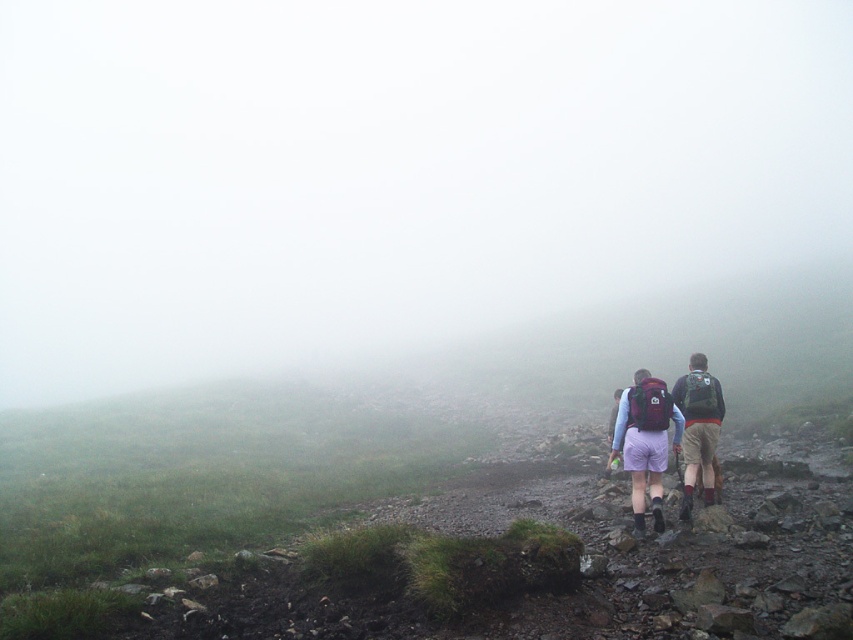
Question: Considering the relative positions of matte purple shorts at center and dark green backpack at right in the image provided, where is matte purple shorts at center located with respect to dark green backpack at right?

Choices:
 (A) right
 (B) left

Answer: (B)

Question: Does matte purple shorts at center lie in front of dark green backpack at right?

Choices:
 (A) yes
 (B) no

Answer: (A)

Question: Which of the following is the farthest from the observer?

Choices:
 (A) (683, 480)
 (B) (698, 429)

Answer: (A)

Question: Among these points, which one is farthest from the camera?

Choices:
 (A) (616, 420)
 (B) (700, 365)

Answer: (B)

Question: Which of the following is the farthest from the observer?

Choices:
 (A) (722, 408)
 (B) (705, 445)

Answer: (B)

Question: Is matte purple shorts at center smaller than dark green backpack at right?

Choices:
 (A) yes
 (B) no

Answer: (A)